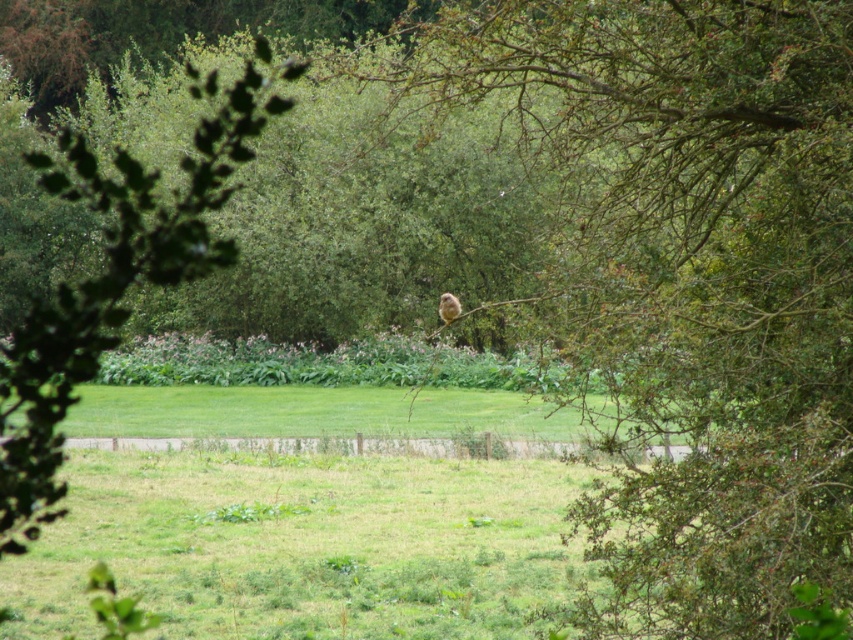
You are standing at the center of the image and want to locate the brown textured branch at center. Which direction should you look to find it?

The brown textured branch at center is located at point (x=688, y=282), so you should look slightly to the right and down from the very center of the image.

You are a photographer trying to capture the green leafy tree at upper left and the fuzzy brown bird at center in a single shot. Based on their sizes in the image, which object would appear larger in your photo?

The green leafy tree at upper left would appear larger than the fuzzy brown bird at center because its width surpasses the bird.